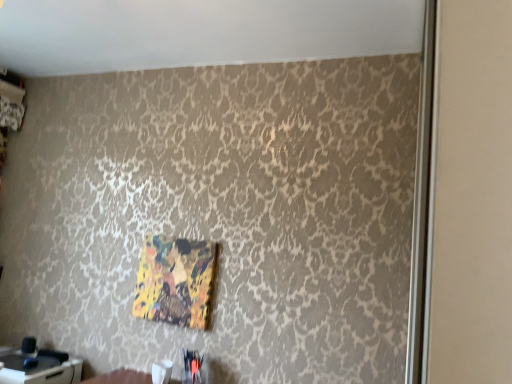
Describe the element at coordinates (175, 281) in the screenshot. I see `wooden painted picture frame at center` at that location.

Locate an element on the screen. The width and height of the screenshot is (512, 384). wooden painted picture frame at center is located at coordinates (175, 281).

Measure the distance between wooden painted picture frame at center and camera.

wooden painted picture frame at center is 7.24 feet away from camera.

Measure the distance between point (x=173, y=288) and camera.

A distance of 7.49 feet exists between point (x=173, y=288) and camera.

You are a GUI agent. You are given a task and a screenshot of the screen. Output one action in this format:
    pyautogui.click(x=<x>, y=<y>)
    Task: Click on the wooden painted picture frame at center
    Image resolution: width=512 pixels, height=384 pixels.
    Given the screenshot: What is the action you would take?
    pyautogui.click(x=175, y=281)